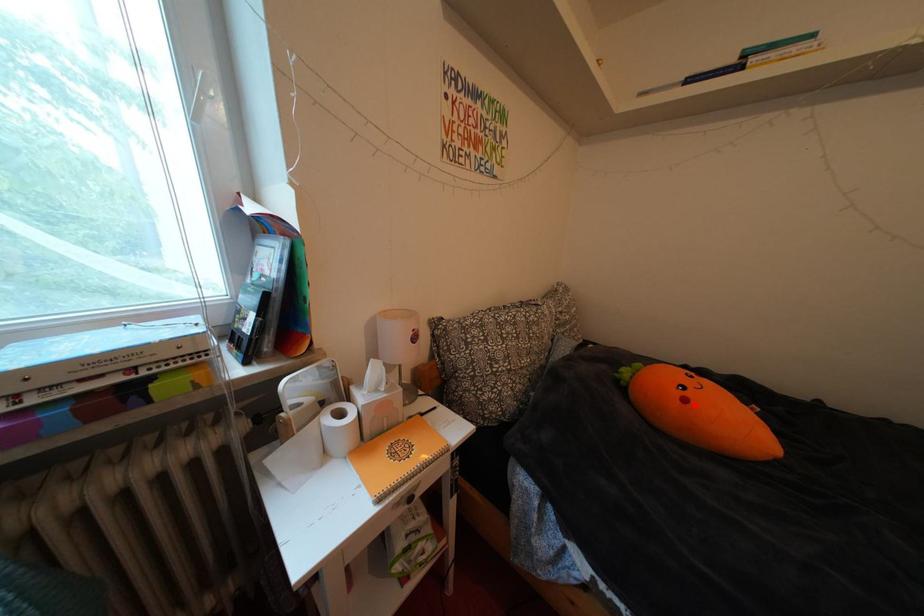
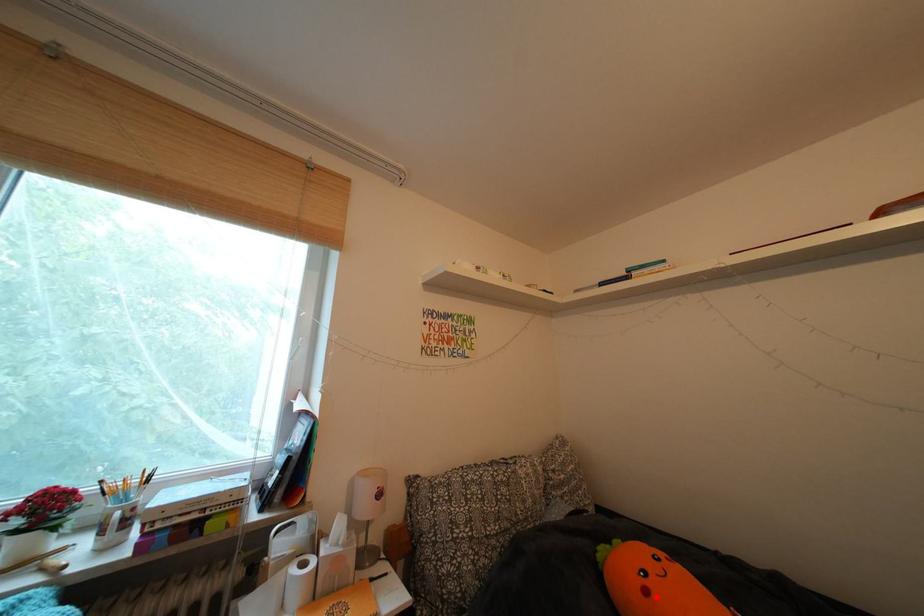
I am providing you with two images of the same scene from different viewpoints. A red point is marked on the first image and another point is marked on the second image. Do the highlighted points in image1 and image2 indicate the same real-world spot?

Yes